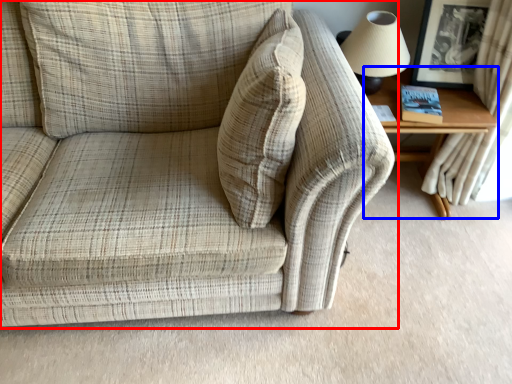
Question: Which of the following is the closest to the observer, studio couch (highlighted by a red box) or table (highlighted by a blue box)?

Choices:
 (A) studio couch
 (B) table

Answer: (A)